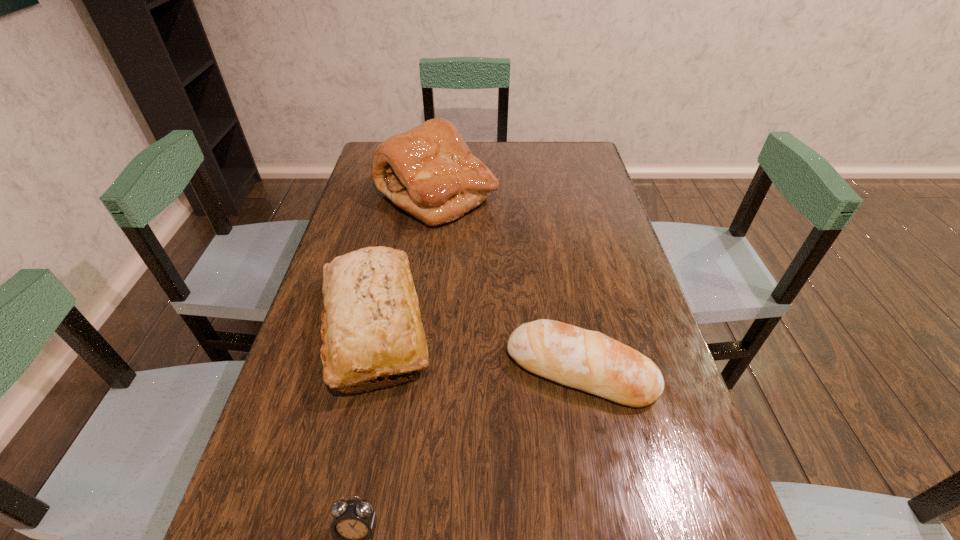
The image size is (960, 540). Find the location of `the farthest bread`. the farthest bread is located at coordinates (428, 171).

This screenshot has height=540, width=960. Find the location of `the tallest bread`. the tallest bread is located at coordinates (428, 171).

Where is `the second shortest bread`? This screenshot has height=540, width=960. the second shortest bread is located at coordinates (371, 326).

Locate an element on the screen. the shortest bread is located at coordinates (587, 360).

The width and height of the screenshot is (960, 540). What are the coordinates of `vacant space located 0.150m on the filling side of the farthest object` in the screenshot? It's located at [x=544, y=194].

Identify the location of free space located 0.330m on the right of the second tallest object. [x=577, y=326].

The image size is (960, 540). Find the location of `vacant point located on the back of the shortest bread`. vacant point located on the back of the shortest bread is located at coordinates (566, 297).

Where is `object at the far edge`? object at the far edge is located at coordinates (428, 171).

Locate an element on the screen. Image resolution: width=960 pixels, height=540 pixels. object positioned at the right edge is located at coordinates (587, 360).

I want to click on object at the far left corner, so click(428, 171).